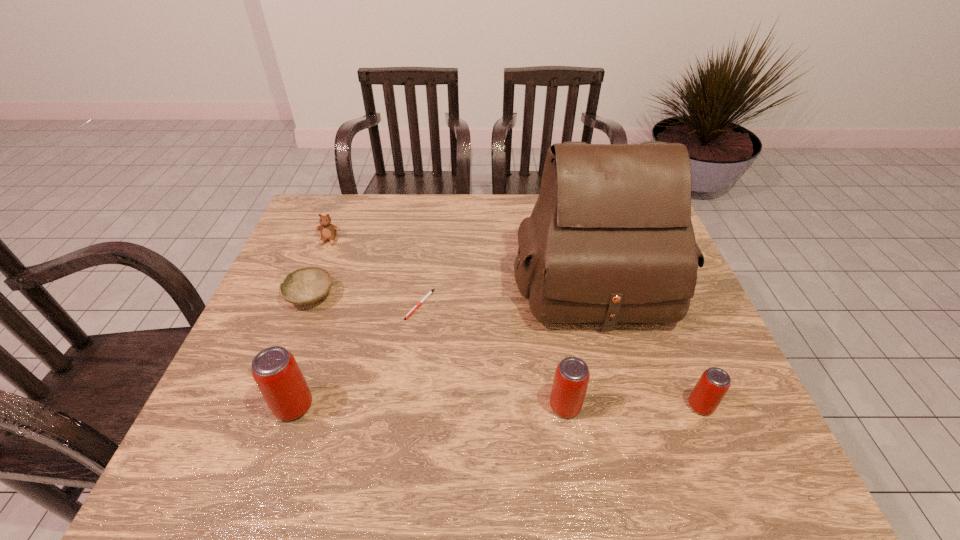
The image size is (960, 540). What are the coordinates of `the leftmost beer can` in the screenshot? It's located at (275, 370).

Where is `the second tallest object`? This screenshot has height=540, width=960. the second tallest object is located at coordinates (275, 370).

In order to click on the second beer can from left to right in this screenshot , I will do `click(571, 379)`.

Where is `the second shortest beer can`? the second shortest beer can is located at coordinates (571, 379).

You are a GUI agent. You are given a task and a screenshot of the screen. Output one action in this format:
    pyautogui.click(x=<x>, y=<y>)
    Task: Click on the rightmost beer can
    Image resolution: width=960 pixels, height=540 pixels.
    Given the screenshot: What is the action you would take?
    pyautogui.click(x=709, y=391)

Find the location of `the shortest beer can`. the shortest beer can is located at coordinates (709, 391).

This screenshot has width=960, height=540. Identify the location of the third shortest object. (328, 231).

The image size is (960, 540). What are the coordinates of `the tallest object` in the screenshot? It's located at (610, 240).

Identify the location of bowl. (307, 285).

The width and height of the screenshot is (960, 540). Identify the location of the shortest object. (431, 291).